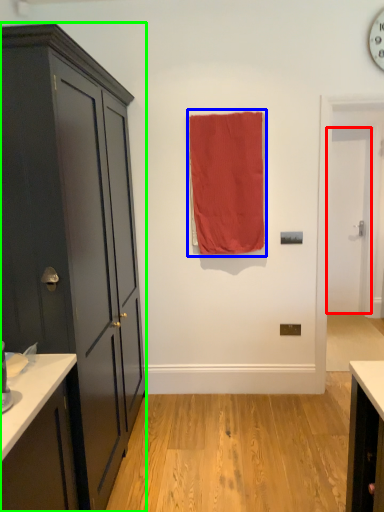
Question: Which object is the farthest from door (highlighted by a red box)? Choose among these: curtain (highlighted by a blue box) or cabinetry (highlighted by a green box).

Choices:
 (A) curtain
 (B) cabinetry

Answer: (B)